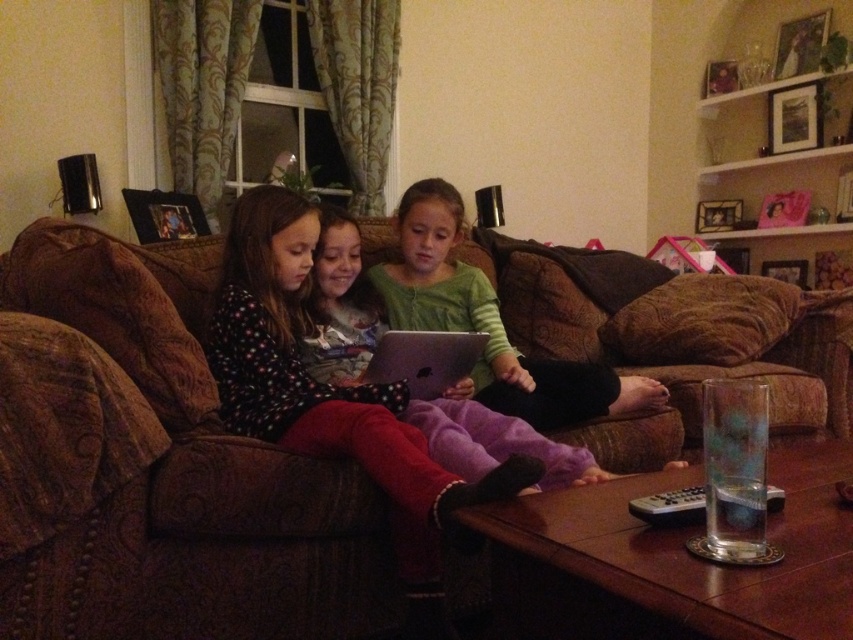
You are a delivery robot that needs to place a small package between the polka dot fleece at center and the silver metallic laptop at center. Can you fit the package in that space if it measures 24 centimeters long?

The distance between the polka dot fleece at center and the silver metallic laptop at center is 23.89 centimeters. Since the package is 24 centimeters long, it would not fit in the space between them.

You are standing at the entrance of the living room and see two points marked on the sofa where the girls are sitting. Which point is closer to you, point (273, 436) or point (440, 348)?

Point (273, 436) is in front of point (440, 348), so it is closer to you.